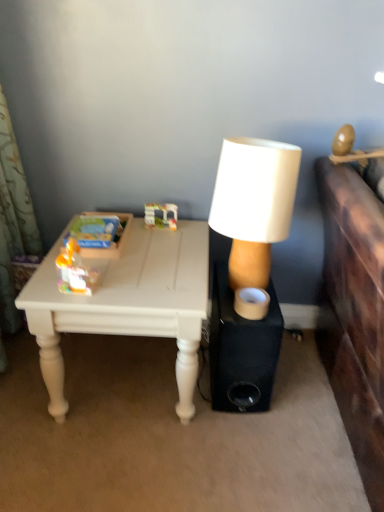
At what (x,y) coordinates should I click in order to perform the action: click on free space on the front side of white painted wood table at lower left. Please return your answer as a coordinate pair (x, y). Image resolution: width=384 pixels, height=512 pixels. Looking at the image, I should click on (120, 467).